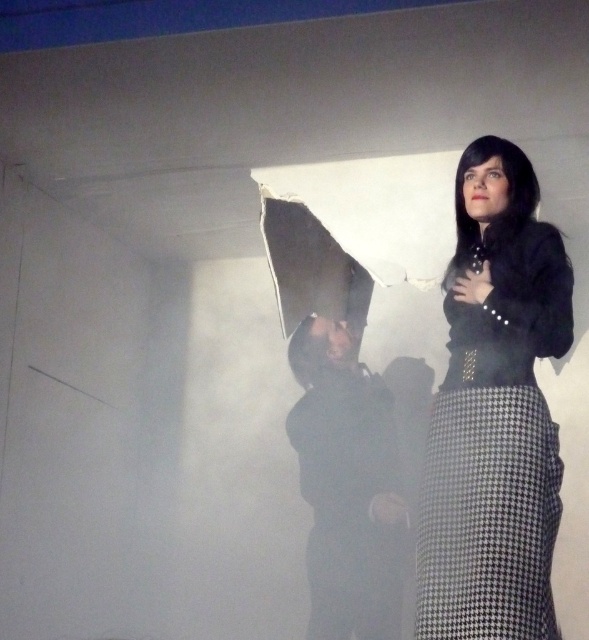
Between black textured skirt at center and black matte jacket at center, which one is positioned higher?

black textured skirt at center is higher up.

Is point (531, 262) less distant than point (362, 563)?

That is True.

This screenshot has width=589, height=640. I want to click on black textured skirt at center, so click(x=494, y=412).